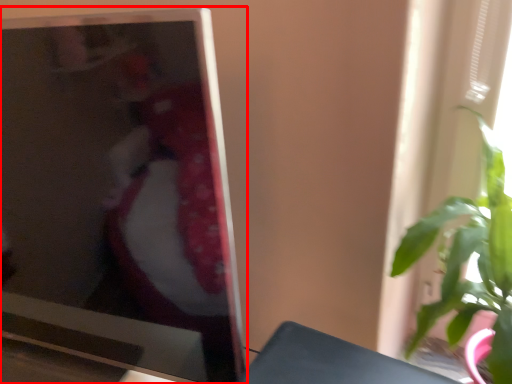
Question: From the image's perspective, considering the relative positions of television (annotated by the red box) and houseplant in the image provided, where is television (annotated by the red box) located with respect to the staircase?

Choices:
 (A) above
 (B) below

Answer: (A)